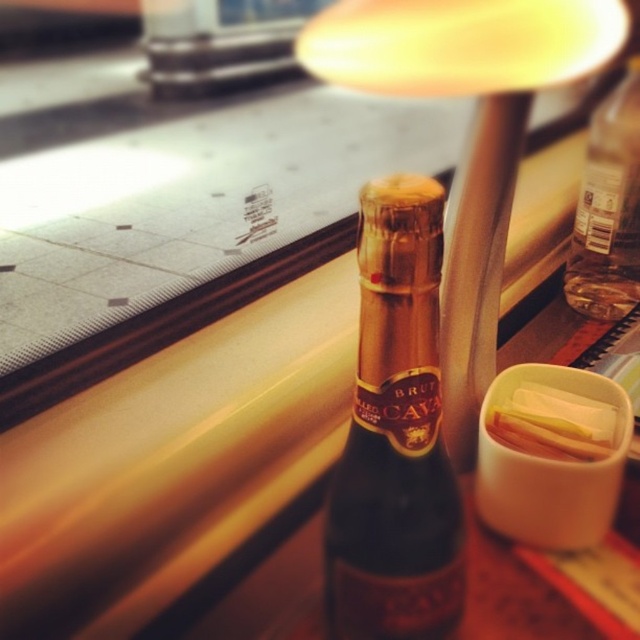
You are a bartender preparing drinks and need to place the dark brown glass bottle at center and the translucent plastic container at upper right on a shelf. The shelf has limited space. Which object should you place first to ensure both fit properly?

The dark brown glass bottle at center should be placed first since it is positioned on the left side of the translucent plastic container at upper right, meaning it takes up more space on the left, so placing it first ensures proper alignment and fit on the shelf.

You are organizing items on a table and need to place the transparent plastic bottle at upper right and the translucent plastic container at upper right. If you want to arrange them side by side without overlapping, which one should be placed first to ensure they both fit?

The transparent plastic bottle at upper right has a lesser width compared to the translucent plastic container at upper right, so you should place the translucent plastic container at upper right first to accommodate its larger width, then position the transparent plastic bottle at upper right next to it.

In the scene shown: You are a bartender preparing drinks and need to place the dark brown glass bottle at center and the translucent plastic container at upper right on a shelf. The shelf has limited height space. Which item should you place first to ensure both fit vertically?

The dark brown glass bottle at center is much taller than the translucent plastic container at upper right, so you should place the taller bottle first to ensure both items fit vertically on the shelf.